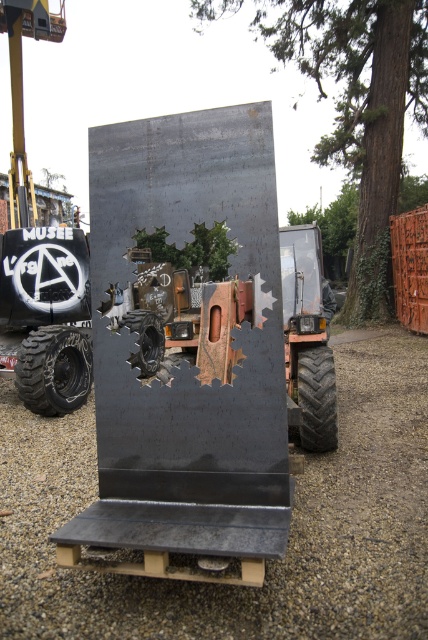
You are a delivery person who needs to move a package from the black rubber tractor at left to the black rubber tire at center. What is the shortest distance you need to travel?

The shortest distance you need to travel is 3.51 meters between the black rubber tractor at left and the black rubber tire at center.